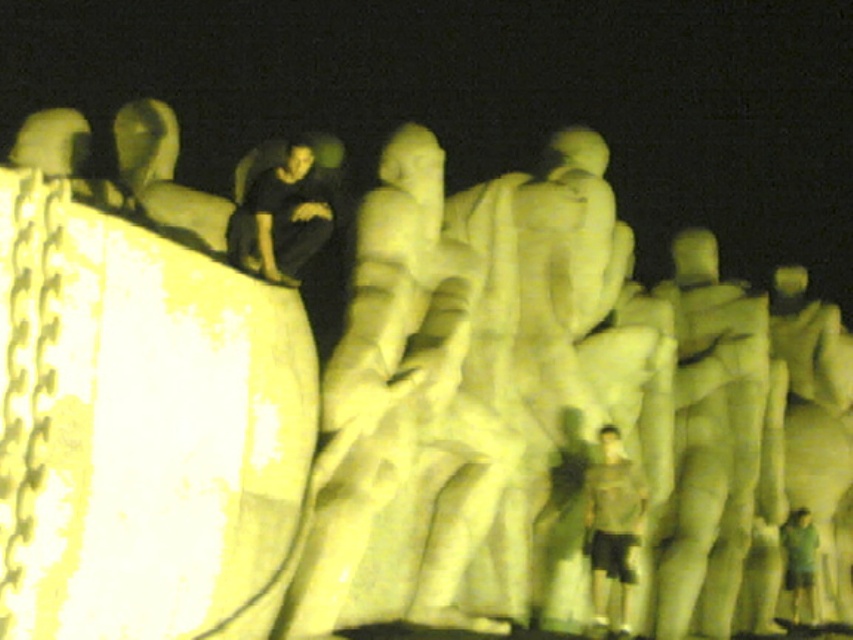
You are a photographer trying to capture both the light brown fabric shirt at center and the green fabric shirt at lower right in a single frame. Which shirt should you focus on to ensure both are in the frame without moving the camera?

The light brown fabric shirt at center is wider than the green fabric shirt at lower right, so focusing on the light brown fabric shirt at center will ensure both are in the frame since it occupies more space.

You are a photographer trying to capture a photo of the sculpture while ensuring both the light brown fabric shirt at center and the green fabric shirt at lower right are visible in the frame. Based on their positions, which shirt should you focus on first to include both in the shot?

The light brown fabric shirt at center is positioned on the left side of green fabric shirt at lower right. To include both in the shot, focus on the light brown fabric shirt at center first as it is closer to the center and adjust the frame to include the green fabric shirt at lower right.